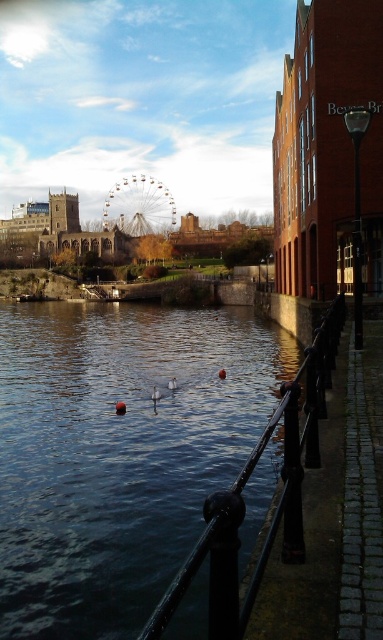
Question: Which of the following is the farthest from the observer?

Choices:
 (A) metallic ferris wheel at center
 (B) black metal rail at lower center

Answer: (A)

Question: Is black metal rail at lower center wider than metallic ferris wheel at center?

Choices:
 (A) no
 (B) yes

Answer: (A)

Question: Can you confirm if black metal rail at lower center is positioned to the left of metallic ferris wheel at center?

Choices:
 (A) yes
 (B) no

Answer: (B)

Question: Which point is closer to the camera taking this photo?

Choices:
 (A) (122, 182)
 (B) (222, 499)

Answer: (B)

Question: Which of the following is the farthest from the observer?

Choices:
 (A) black metal rail at lower center
 (B) metallic ferris wheel at center

Answer: (B)

Question: Is black metal rail at lower center thinner than metallic ferris wheel at center?

Choices:
 (A) no
 (B) yes

Answer: (B)